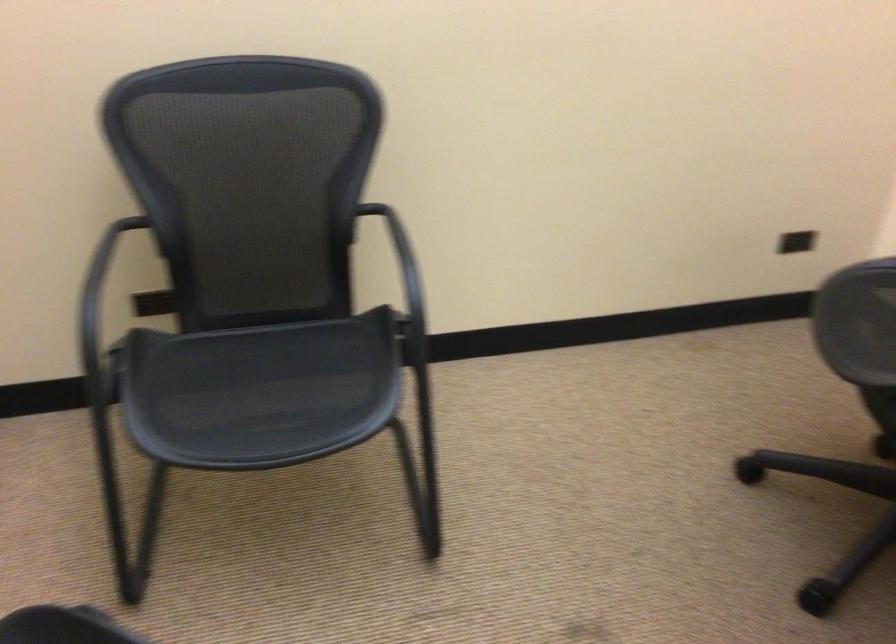
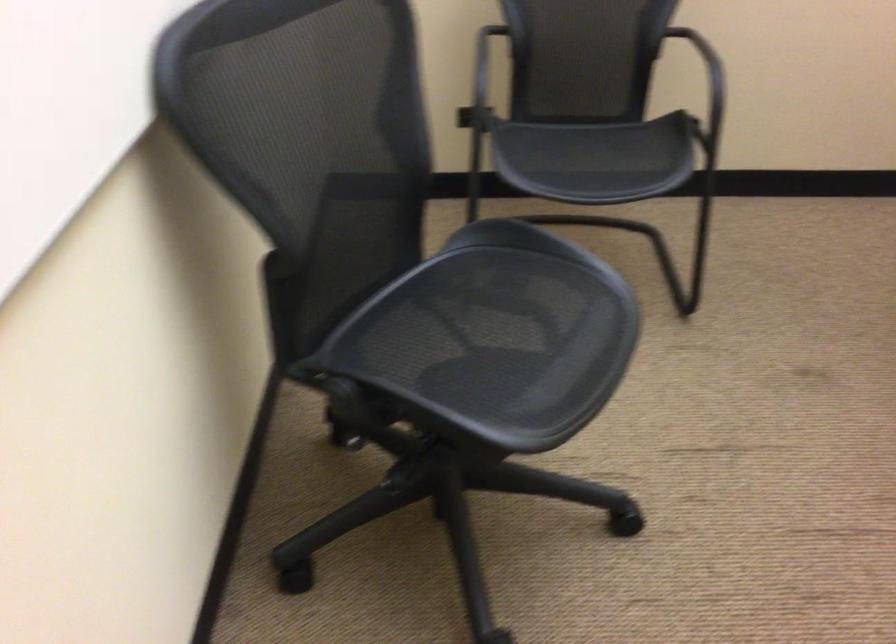
Question: What movement of the cameraman would produce the second image?

Choices:
 (A) Left
 (B) Right
 (C) Forward
 (D) Backward

Answer: (D)